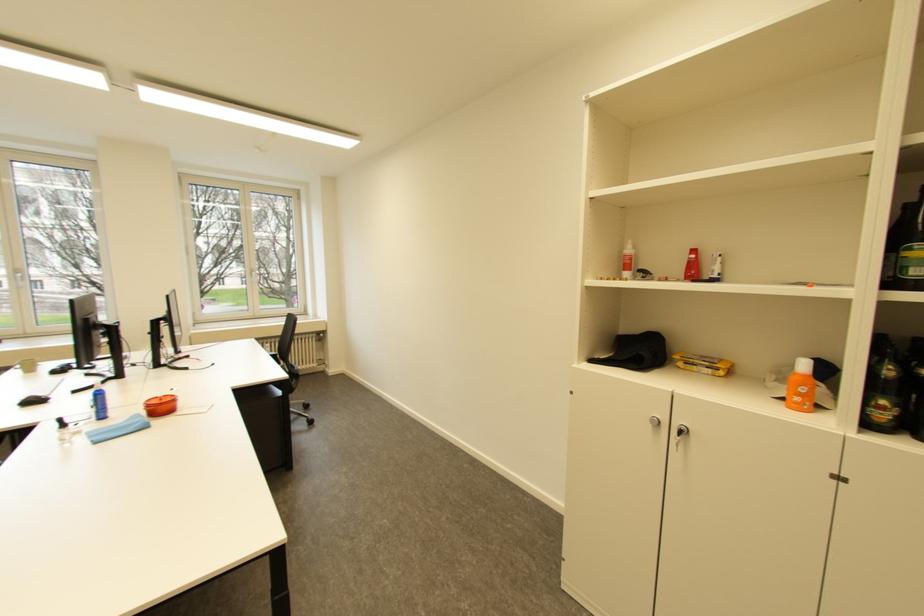
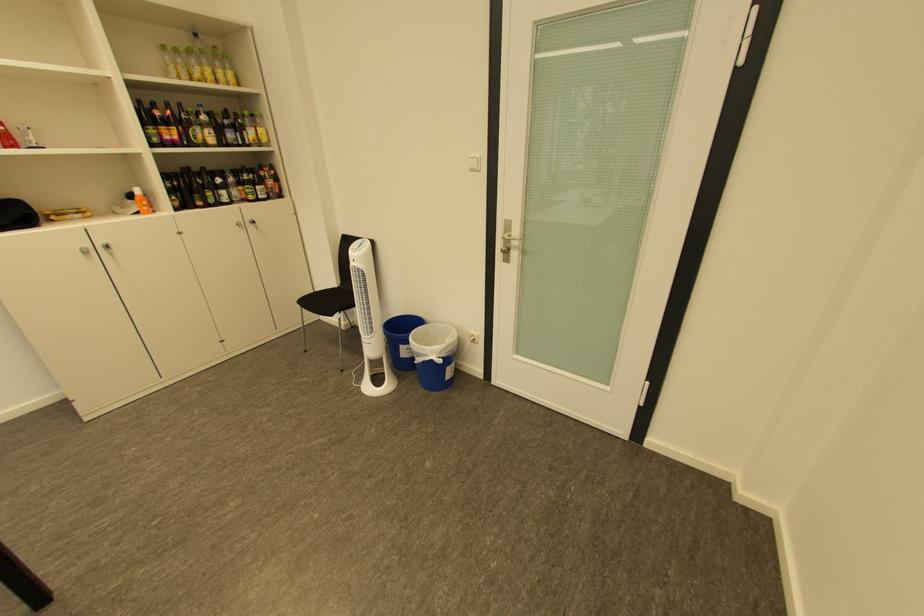
Where in the second image is the point corresponding to pixel 719 371 from the first image?

(90, 216)